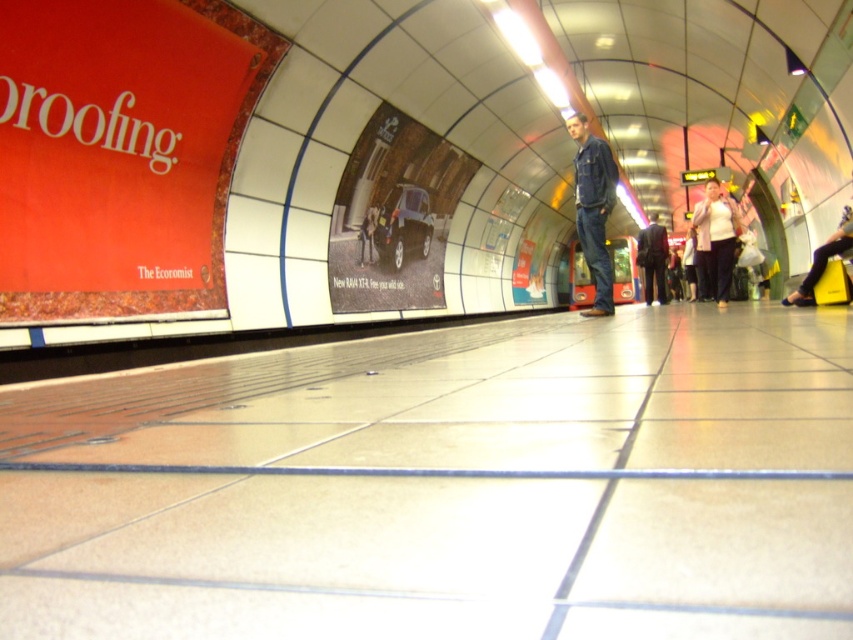
Question: Which point is farther to the camera?

Choices:
 (A) (645, 259)
 (B) (732, 253)

Answer: (A)

Question: Which of the following is the closest to the observer?

Choices:
 (A) white textured sweater at right
 (B) denim jacket at center

Answer: (B)

Question: In this image, where is white textured sweater at right located relative to dark brown suit at center?

Choices:
 (A) right
 (B) left

Answer: (B)

Question: Is white textured sweater at right thinner than dark brown suit at center?

Choices:
 (A) yes
 (B) no

Answer: (B)

Question: Which object is positioned closest to the white textured sweater at right?

Choices:
 (A) denim jacket at center
 (B) dark brown suit at center

Answer: (B)

Question: Where is denim jacket at center located in relation to white textured sweater at right in the image?

Choices:
 (A) above
 (B) below

Answer: (A)